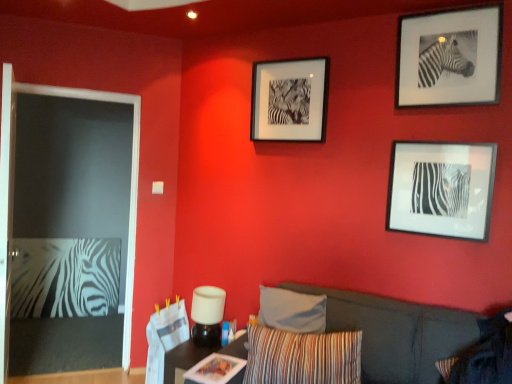
Locate an element on the screen. The image size is (512, 384). dark gray fabric couch at center is located at coordinates click(x=396, y=333).

At what (x,y) coordinates should I click in order to perform the action: click on wooden table at lower center. Please return your answer as a coordinate pair (x, y). The image size is (512, 384). Looking at the image, I should click on (197, 357).

What do you see at coordinates (449, 57) in the screenshot? Image resolution: width=512 pixels, height=384 pixels. I see `black matte picture frame at upper right, the third picture frame viewed from the left` at bounding box center [449, 57].

The width and height of the screenshot is (512, 384). I want to click on white matte lamp at center, so click(x=207, y=315).

Image resolution: width=512 pixels, height=384 pixels. I want to click on striped fabric pillow at lower center, the second pillow from the right, so tap(302, 357).

The image size is (512, 384). Describe the element at coordinates (290, 100) in the screenshot. I see `black matte picture frame at upper center, acting as the third picture frame starting from the right` at that location.

Where is `dark gray fabric couch at center`? This screenshot has width=512, height=384. dark gray fabric couch at center is located at coordinates (396, 333).

Is black matte picture frame at upper center, arranged as the first picture frame when viewed from the left, facing away from striped fabric pillow at lower center, which appears as the 1th pillow when viewed from the left?

That's not correct — black matte picture frame at upper center, arranged as the first picture frame when viewed from the left, is not looking away from striped fabric pillow at lower center, which appears as the 1th pillow when viewed from the left.

How different are the orientations of black matte picture frame at upper center, arranged as the first picture frame when viewed from the left, and striped fabric pillow at lower center, the second pillow from the right, in degrees?

There is a 16-degree angle between the facing directions of black matte picture frame at upper center, arranged as the first picture frame when viewed from the left, and striped fabric pillow at lower center, the second pillow from the right.

Is black matte picture frame at upper center, acting as the third picture frame starting from the right, not near striped fabric pillow at lower center, the second pillow from the right?

Absolutely, black matte picture frame at upper center, acting as the third picture frame starting from the right, is distant from striped fabric pillow at lower center, the second pillow from the right.

Can you confirm if black matte picture frame at upper center, acting as the third picture frame starting from the right, is bigger than striped fabric pillow at lower center, which appears as the 1th pillow when viewed from the left?

Incorrect, black matte picture frame at upper center, acting as the third picture frame starting from the right, is not larger than striped fabric pillow at lower center, which appears as the 1th pillow when viewed from the left.

Which is in front, dark gray fabric couch at center or black matte picture frame at upper center, acting as the third picture frame starting from the right?

dark gray fabric couch at center.

Considering the relative sizes of dark gray fabric couch at center and black matte picture frame at upper center, arranged as the first picture frame when viewed from the left, in the image provided, is dark gray fabric couch at center taller than black matte picture frame at upper center, arranged as the first picture frame when viewed from the left,?

Yes, dark gray fabric couch at center is taller than black matte picture frame at upper center, arranged as the first picture frame when viewed from the left.

Considering the relative sizes of dark gray fabric couch at center and black matte picture frame at upper center, acting as the third picture frame starting from the right, in the image provided, is dark gray fabric couch at center wider than black matte picture frame at upper center, acting as the third picture frame starting from the right,?

Correct, the width of dark gray fabric couch at center exceeds that of black matte picture frame at upper center, acting as the third picture frame starting from the right.

Is black matte picture frame at upper right, arranged as the first picture frame when viewed from the right, to the right of striped fabric pillow at lower center, which appears as the 1th pillow when viewed from the left, from the viewer's perspective?

Yes, black matte picture frame at upper right, arranged as the first picture frame when viewed from the right, is to the right of striped fabric pillow at lower center, which appears as the 1th pillow when viewed from the left.

Locate an element on the screen. This screenshot has height=384, width=512. the 3rd picture frame above the striped fabric pillow at lower center, the second pillow from the right (from the image's perspective) is located at coordinates (449, 57).

Is black matte picture frame at upper right, arranged as the first picture frame when viewed from the right, taller or shorter than striped fabric pillow at lower center, the second pillow from the right?

In the image, black matte picture frame at upper right, arranged as the first picture frame when viewed from the right, appears to be taller than striped fabric pillow at lower center, the second pillow from the right.

Considering the positions of points (411, 33) and (255, 365), is point (411, 33) closer to camera compared to point (255, 365)?

No, it is behind (255, 365).

From the image's perspective, does striped fabric pillow at lower center, which appears as the 1th pillow when viewed from the left, appear lower than black matte picture frame at upper center, acting as the third picture frame starting from the right?

Correct, striped fabric pillow at lower center, which appears as the 1th pillow when viewed from the left, appears lower than black matte picture frame at upper center, acting as the third picture frame starting from the right, in the image.

What's the angular difference between striped fabric pillow at lower center, the second pillow from the right, and black matte picture frame at upper center, arranged as the first picture frame when viewed from the left,'s facing directions?

The angle between the facing direction of striped fabric pillow at lower center, the second pillow from the right, and the facing direction of black matte picture frame at upper center, arranged as the first picture frame when viewed from the left, is 16 degrees.

From a real-world perspective, between striped fabric pillow at lower center, the second pillow from the right, and black matte picture frame at upper center, arranged as the first picture frame when viewed from the left, who is vertically higher?

From a 3D spatial view, black matte picture frame at upper center, arranged as the first picture frame when viewed from the left, is above.

Measure the distance between striped fabric pillow at lower center, which appears as the 1th pillow when viewed from the left, and black matte picture frame at upper center, acting as the third picture frame starting from the right.

1.38 meters.

Considering the positions of objects wooden table at lower center and striped fabric pillow at lower right, which is the first pillow in right-to-left order, in the image provided, who is more to the left, wooden table at lower center or striped fabric pillow at lower right, which is the first pillow in right-to-left order,?

From the viewer's perspective, wooden table at lower center appears more on the left side.

Based on the photo, in the image, is wooden table at lower center positioned in front of or behind striped fabric pillow at lower right, which is the first pillow in right-to-left order?

Visually, wooden table at lower center is located behind striped fabric pillow at lower right, which is the first pillow in right-to-left order.

Could you measure the distance between wooden table at lower center and striped fabric pillow at lower right, the second pillow when ordered from left to right?

A distance of 1.05 meters exists between wooden table at lower center and striped fabric pillow at lower right, the second pillow when ordered from left to right.

Is wooden table at lower center bigger than striped fabric pillow at lower right, the second pillow when ordered from left to right?

Actually, wooden table at lower center might be smaller than striped fabric pillow at lower right, the second pillow when ordered from left to right.

Considering the positions of objects white matte lamp at center and wooden table at lower center in the image provided, who is behind, white matte lamp at center or wooden table at lower center?

white matte lamp at center is further from the camera.

Does white matte lamp at center have a greater height compared to wooden table at lower center?

Correct, white matte lamp at center is much taller as wooden table at lower center.

Looking at this image, considering the relative sizes of white matte lamp at center and wooden table at lower center in the image provided, is white matte lamp at center smaller than wooden table at lower center?

Yes.

Is white matte lamp at center turned away from wooden table at lower center?

white matte lamp at center is not turned away from wooden table at lower center.

Based on the photo, considering the relative sizes of white matte lamp at center and black matte picture frame at upper right, the third picture frame viewed from the left, in the image provided, is white matte lamp at center bigger than black matte picture frame at upper right, the third picture frame viewed from the left,?

Yes.

From the image's perspective, which object appears higher, white matte lamp at center or black matte picture frame at upper right, arranged as the first picture frame when viewed from the right?

From the image's view, black matte picture frame at upper right, arranged as the first picture frame when viewed from the right, is above.

Is white matte lamp at center wider or thinner than black matte picture frame at upper right, arranged as the first picture frame when viewed from the right?

Considering their sizes, white matte lamp at center looks broader than black matte picture frame at upper right, arranged as the first picture frame when viewed from the right.

Is white matte lamp at center taller or shorter than black matte picture frame at upper right, arranged as the first picture frame when viewed from the right?

In the image, white matte lamp at center appears to be shorter than black matte picture frame at upper right, arranged as the first picture frame when viewed from the right.

From the image's perspective, which picture frame is the 2nd one above the striped fabric pillow at lower center, which appears as the 1th pillow when viewed from the left? Please provide its 2D coordinates.

[(290, 100)]

Locate an element on the screen. Image resolution: width=512 pixels, height=384 pixels. couch below the black matte picture frame at upper center, arranged as the first picture frame when viewed from the left (from the image's perspective) is located at coordinates (396, 333).

Based on the photo, which object lies further to the anchor point striped fabric pillow at lower center, the second pillow from the right, black matte picture frame at upper center, arranged as the first picture frame when viewed from the left, or white matte lamp at center?

black matte picture frame at upper center, arranged as the first picture frame when viewed from the left, is further to striped fabric pillow at lower center, the second pillow from the right.

Considering their positions, is black matte picture frame at upper right, the third picture frame viewed from the left, positioned further to white matte lamp at center than dark gray fabric couch at center?

black matte picture frame at upper right, the third picture frame viewed from the left, lies further to white matte lamp at center than the other object.

When comparing their distances from striped fabric pillow at lower right, which is the first pillow in right-to-left order, does black matte picture frame at center-right, acting as the 2th picture frame starting from the left, or dark gray fabric couch at center seem closer?

dark gray fabric couch at center.

From the image, which object appears to be farther from dark gray fabric couch at center, striped fabric pillow at lower right, the second pillow when ordered from left to right, or black matte picture frame at upper center, arranged as the first picture frame when viewed from the left?

Among the two, black matte picture frame at upper center, arranged as the first picture frame when viewed from the left, is located further to dark gray fabric couch at center.

Based on their spatial positions, is dark gray fabric couch at center or black matte picture frame at upper right, arranged as the first picture frame when viewed from the right, further from wooden table at lower center?

Among the two, black matte picture frame at upper right, arranged as the first picture frame when viewed from the right, is located further to wooden table at lower center.

Estimate the real-world distances between objects in this image. Which object is closer to striped fabric pillow at lower right, the second pillow when ordered from left to right, white matte lamp at center or black matte picture frame at upper center, arranged as the first picture frame when viewed from the left?

Among the two, white matte lamp at center is located nearer to striped fabric pillow at lower right, the second pillow when ordered from left to right.

Based on their spatial positions, is wooden table at lower center or striped fabric pillow at lower center, the second pillow from the right, further from dark gray fabric couch at center?

wooden table at lower center is positioned further to the anchor dark gray fabric couch at center.

Based on their spatial positions, is striped fabric pillow at lower right, which is the first pillow in right-to-left order, or black matte picture frame at upper right, arranged as the first picture frame when viewed from the right, further from striped fabric pillow at lower center, which appears as the 1th pillow when viewed from the left?

The object further to striped fabric pillow at lower center, which appears as the 1th pillow when viewed from the left, is black matte picture frame at upper right, arranged as the first picture frame when viewed from the right.

I want to click on pillow between black matte picture frame at upper right, the third picture frame viewed from the left, and striped fabric pillow at lower center, which appears as the 1th pillow when viewed from the left, vertically, so click(443, 339).

The image size is (512, 384). I want to click on picture frame between black matte picture frame at upper center, arranged as the first picture frame when viewed from the left, and white matte lamp at center in the up-down direction, so click(441, 189).

Identify the location of lamp between black matte picture frame at upper right, arranged as the first picture frame when viewed from the right, and wooden table at lower center in the up-down direction. Image resolution: width=512 pixels, height=384 pixels. (207, 315).

Locate an element on the screen. This screenshot has width=512, height=384. pillow between black matte picture frame at upper center, arranged as the first picture frame when viewed from the left, and striped fabric pillow at lower center, the second pillow from the right, from top to bottom is located at coordinates (443, 339).